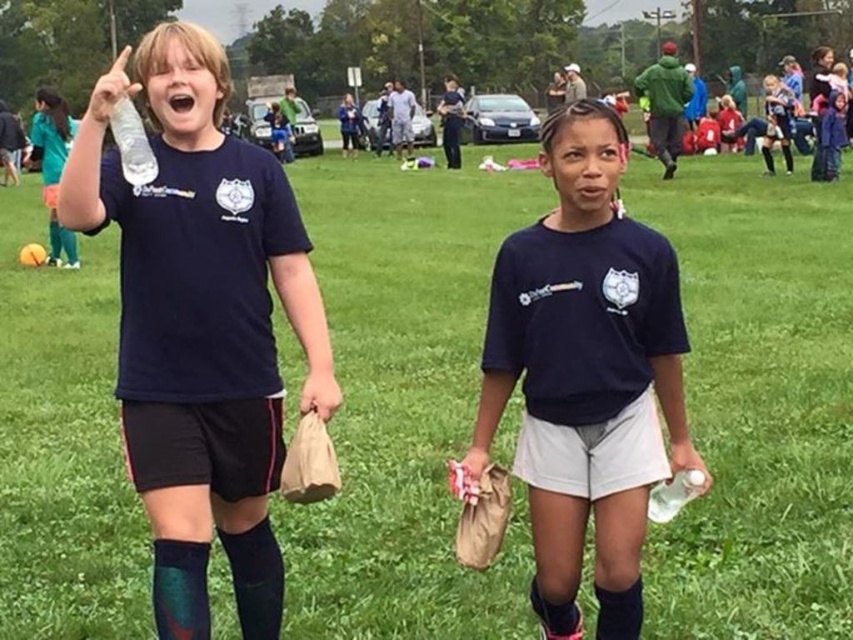
You are a photographer positioned at the edge of the field. You want to capture a closeup shot of the matte black water bottle at left without moving your camera. Can you do it?

The matte black water bottle at left is 2.97 meters from viewer. Since the photographer is at the edge of the field and the bottle is 2.97 meters away, they can likely zoom in to capture a closeup without moving the camera.

You are a photographer trying to capture the clear plastic bottle at lower right and the black knit sock at lower right in the same frame. Based on their positions, which object should you adjust your camera to focus on first if you want to include both in your shot?

The black knit sock at lower right is to the left of the clear plastic bottle at lower right, so you should focus on the black knit sock at lower right first to ensure both are in the frame.